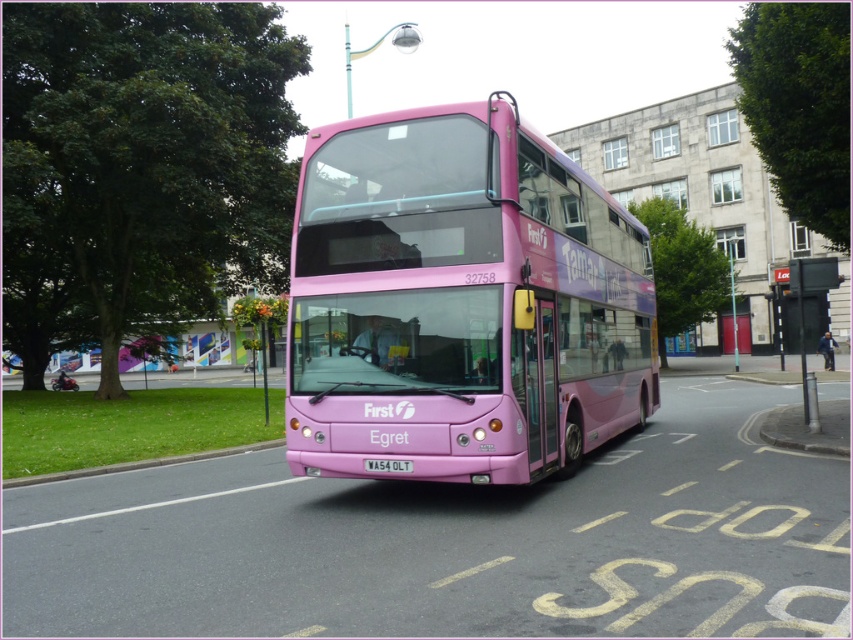
Looking at this image, you are a delivery driver who needs to park your truck exactly at the same spot where the pink matte bus at center is currently parked. According to the coordinates provided, what are the exact 2D coordinates you should aim for to park your truck in the same location?

The exact 2D coordinates for the pink matte bus at center are 0.472 in the x direction and 0.542 in the y direction, so you should aim for the coordinates point (461,301) to park your truck in the same location.

From the picture: You are a photographer trying to capture a clear photo of the white plastic license plate at center. However, the pink matte bus at center is blocking your view. Can you move the bus to get a better shot, and why?

The pink matte bus at center is larger in size than white plastic license plate at center, so moving the bus would allow you to get a clear shot of the license plate since the bus is currently obstructing it.

You are a delivery driver who needs to park your truck, which is 3 meters wide, in the parking lot behind the pink matte bus at center. The parking lot has a space next to the green grass at lower left. Can your truck fit into that space if the space must be wider than the truck?

The pink matte bus at center is wider than the green grass at lower left. Since the parking space next to the green grass at lower left is narrower than the bus, and the truck is 3 meters wide, it depends on the actual width of the grass area. However, since the bus is wider, the grass area might be too narrow. Without exact measurements, it is uncertain if the truck can fit.